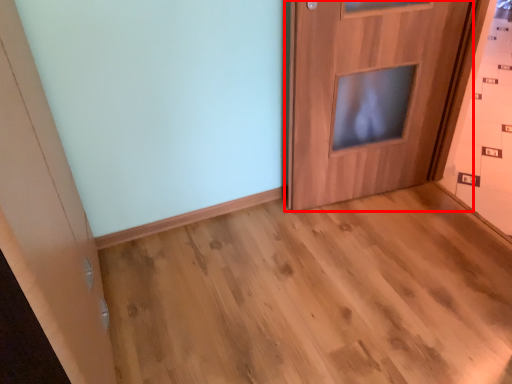
Question: Observing the image, what is the correct spatial positioning of door (annotated by the red box) in reference to corridor?

Choices:
 (A) right
 (B) left

Answer: (A)